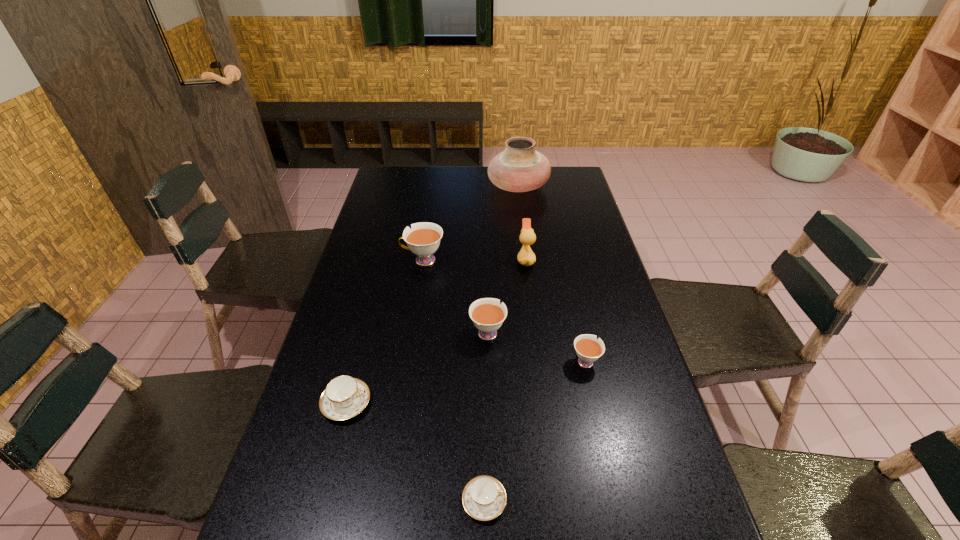
Image resolution: width=960 pixels, height=540 pixels. I want to click on the tallest object, so click(x=520, y=168).

This screenshot has width=960, height=540. In order to click on the farthest object in this screenshot , I will do `click(520, 168)`.

I want to click on tan duck, so click(x=526, y=257).

Find the location of a particular element. the farthest white teacup is located at coordinates pyautogui.click(x=423, y=240).

Where is `the leftmost white teacup`? The height and width of the screenshot is (540, 960). the leftmost white teacup is located at coordinates (423, 240).

This screenshot has height=540, width=960. Identify the location of the second white teacup from left to right. (487, 314).

At what (x,y) coordinates should I click in order to perform the action: click on the second smallest white teacup. Please return your answer as a coordinate pair (x, y). This screenshot has width=960, height=540. Looking at the image, I should click on (487, 314).

The width and height of the screenshot is (960, 540). Find the location of `the smallest white teacup`. the smallest white teacup is located at coordinates (588, 348).

Identify the location of the rightmost white teacup. (588, 348).

The image size is (960, 540). Find the location of `the sixth farthest object`. the sixth farthest object is located at coordinates (344, 397).